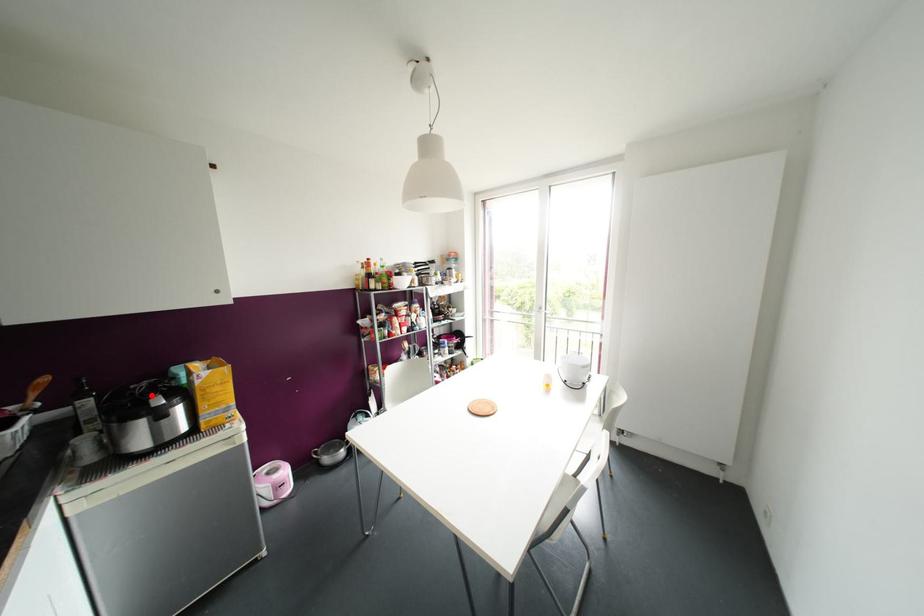
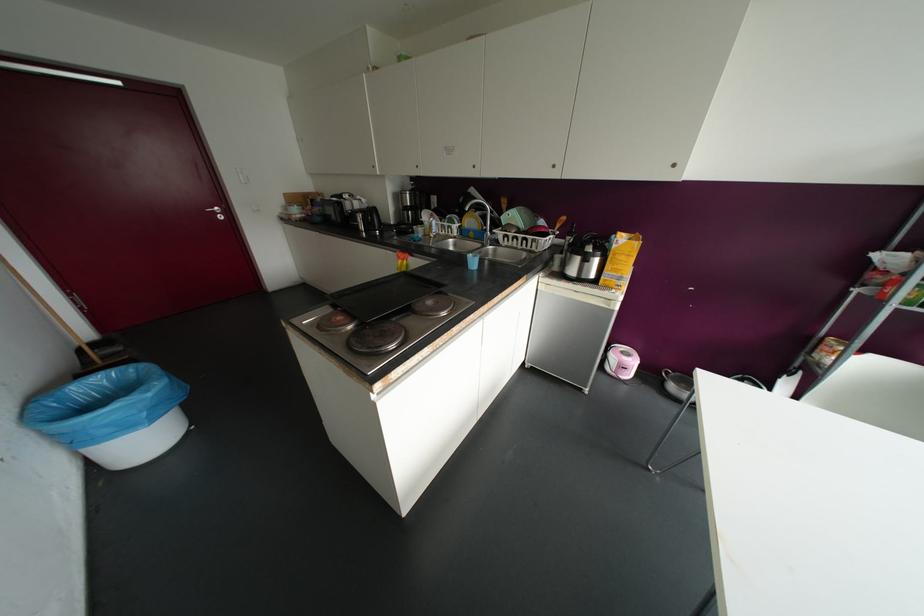
In the second image, find the point that corresponds to the highlighted location in the first image.

(589, 244)